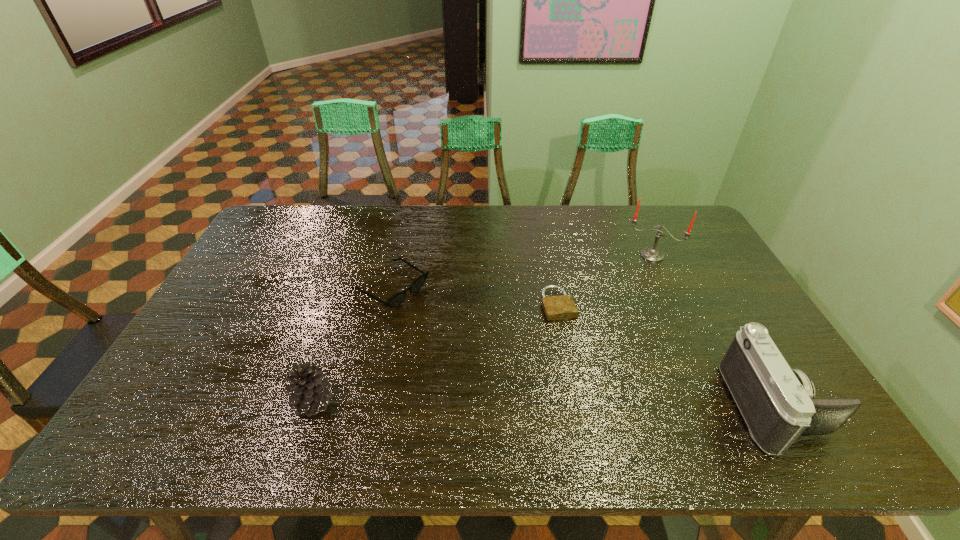
Identify the location of vacant space located on the keyhole side of the third object from right to left. (587, 379).

The image size is (960, 540). Identify the location of free space located on the keyhole side of the third object from right to left. (570, 337).

This screenshot has width=960, height=540. In order to click on vacant region located 0.090m on the keyhole side of the third object from right to left in this screenshot , I will do `click(573, 346)`.

The height and width of the screenshot is (540, 960). Identify the location of vacant space located 0.230m on the front-facing side of the sunglasses. (480, 340).

Locate an element on the screen. vacant space situated 0.240m on the front-facing side of the sunglasses is located at coordinates (483, 342).

At what (x,y) coordinates should I click in order to perform the action: click on vacant space positioned 0.130m on the front-facing side of the sunglasses. Please return your answer as a coordinate pair (x, y). This screenshot has width=960, height=540. Looking at the image, I should click on (452, 324).

What are the coordinates of `pinecone at the near edge` in the screenshot? It's located at (309, 388).

Image resolution: width=960 pixels, height=540 pixels. Identify the location of camera that is at the near edge. (777, 403).

I want to click on camera that is positioned at the right edge, so click(x=777, y=403).

Find the location of a particular element. This screenshot has width=960, height=540. candle that is at the right edge is located at coordinates (652, 254).